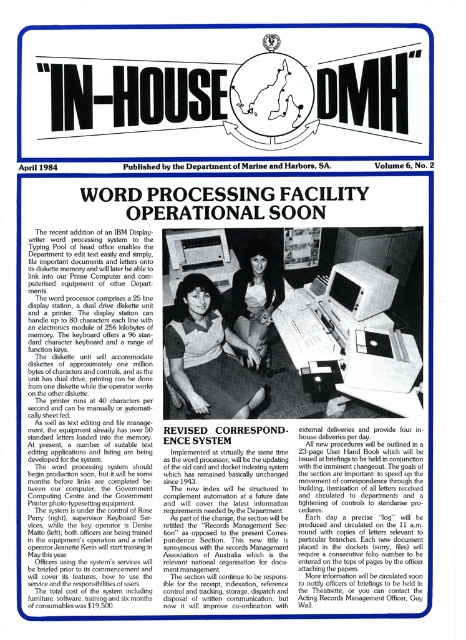
You are looking at the image of the IN HOUSE DMH publication. Where is the matte black shirt at center positioned relative to the title section?

The matte black shirt at center is located at point (208, 355) which is below the title section.